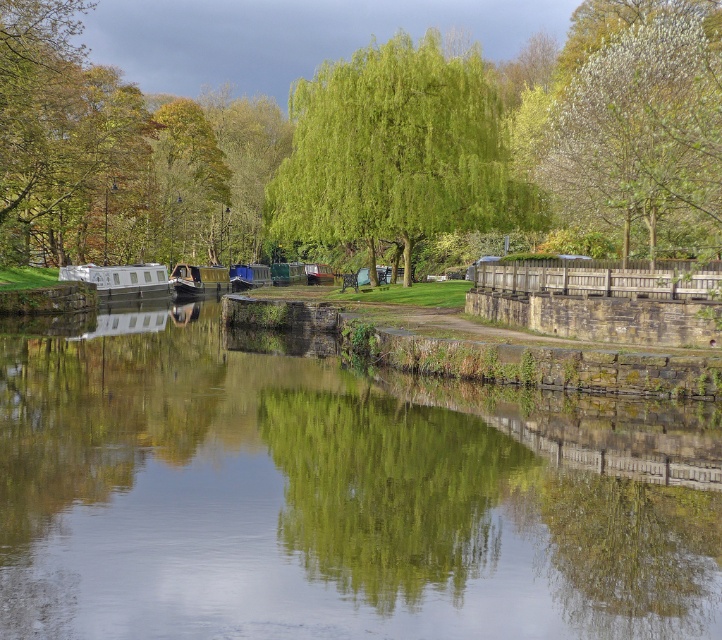
What is the exact coordinate of the green stone river at center?

The green stone river at center is located at point (336, 497).

You are standing on the bank of the canal and want to know the distance between the green stone river at center and the green leafy tree at center. Can you estimate how far apart they are?

The green stone river at center is 21.76 meters from the green leafy tree at center, so they are approximately 21.76 meters apart.

You are standing at the point with coordinates point (705, 45) and want to walk to the point with coordinates point (653, 588). Which direction should you move to reach your destination?

You should move forward because point (653, 588) is in front of point (705, 45).